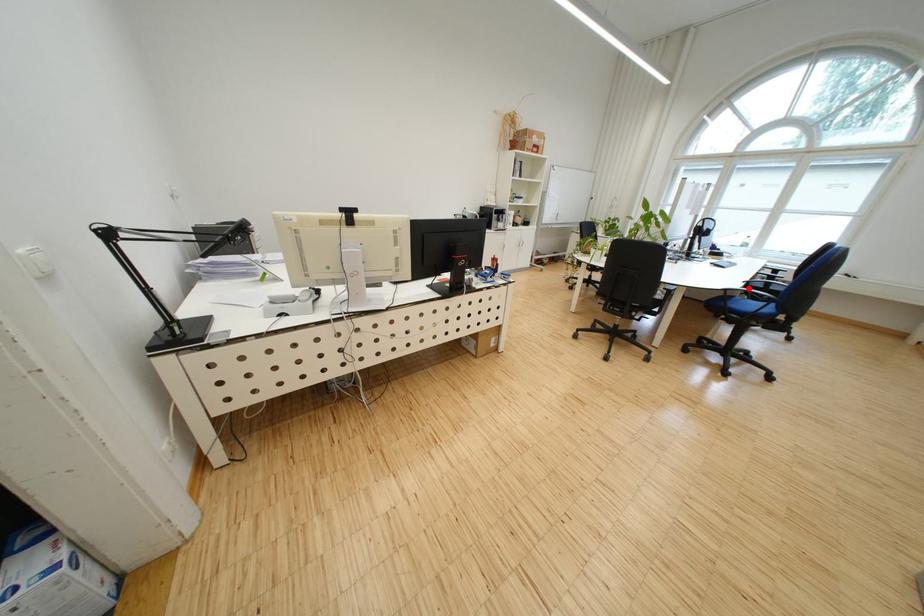
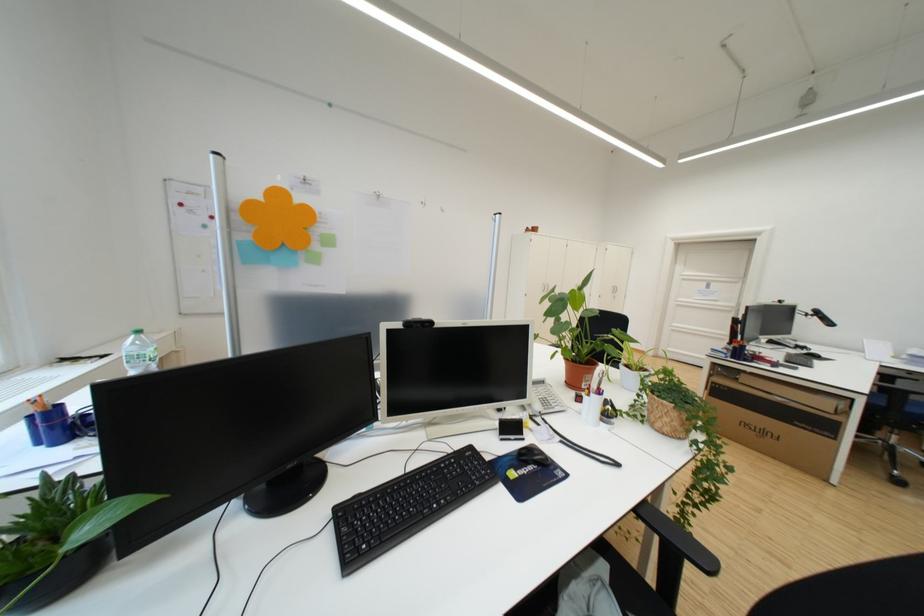
Question: I am providing you with two images of the same scene from different viewpoints. A red point is marked on the first image. Is the red point's position out of view in image 2?

Choices:
 (A) Yes
 (B) No

Answer: (A)